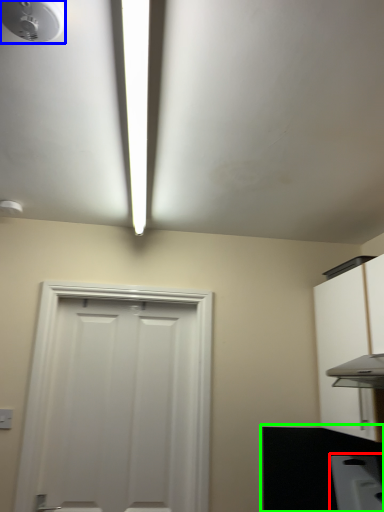
Question: Based on their relative distances, which object is nearer to appliance (highlighted by a red box)? Choose from droplight (highlighted by a blue box) and counter top (highlighted by a green box).

Choices:
 (A) droplight
 (B) counter top

Answer: (B)